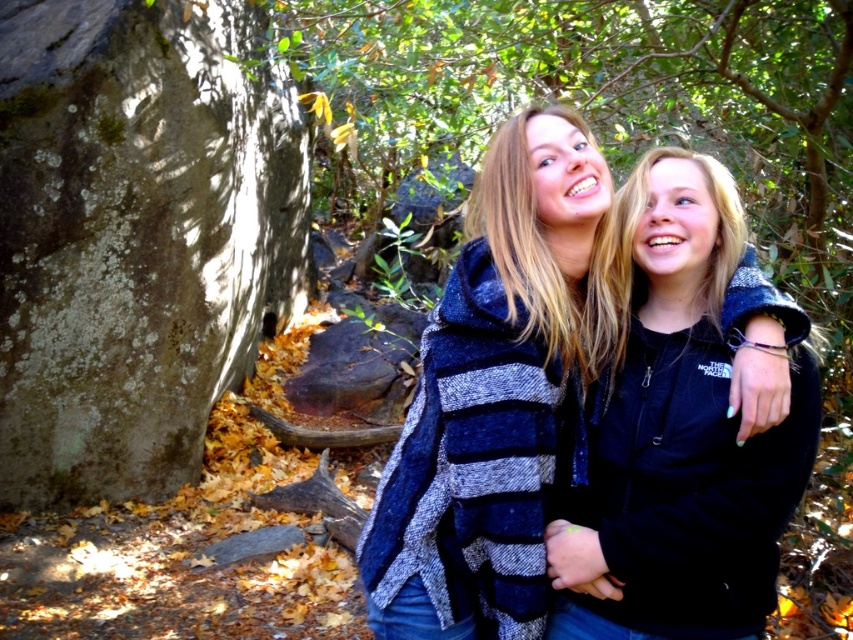
Is green leafy tree at center bigger than blue striped sweater at center?

Yes.

Which is behind, point (625, 8) or point (572, 160)?

Point (625, 8)

Between point (360, 51) and point (566, 337), which one is positioned behind?

The point (360, 51) is behind.

Find the location of a particular element. This screenshot has height=640, width=853. green leafy tree at center is located at coordinates (619, 134).

Can you confirm if gray mossy rock at left is positioned to the left of green leafy tree at center?

Yes, gray mossy rock at left is to the left of green leafy tree at center.

What do you see at coordinates (136, 236) in the screenshot? This screenshot has width=853, height=640. I see `gray mossy rock at left` at bounding box center [136, 236].

Identify the location of gray mossy rock at left. (136, 236).

Does gray mossy rock at left have a greater width compared to black fleece jacket at center?

Indeed, gray mossy rock at left has a greater width compared to black fleece jacket at center.

The width and height of the screenshot is (853, 640). In order to click on gray mossy rock at left in this screenshot , I will do `click(136, 236)`.